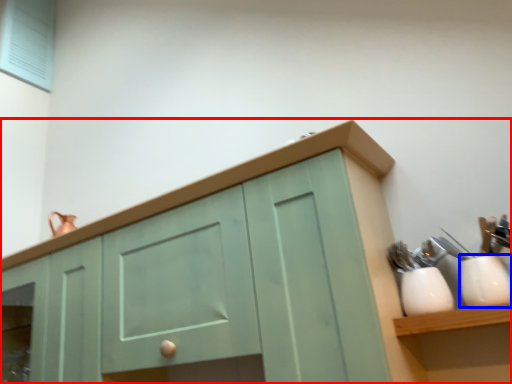
Question: Which of the following is the closest to the observer, cabinetry (highlighted by a red box) or tableware (highlighted by a blue box)?

Choices:
 (A) cabinetry
 (B) tableware

Answer: (A)